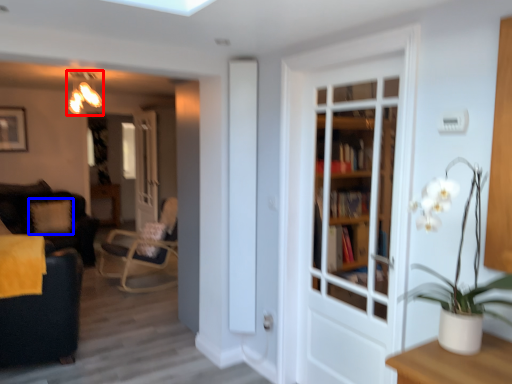
Question: Which object is further to the camera taking this photo, light fixture (highlighted by a red box) or pillow (highlighted by a blue box)?

Choices:
 (A) light fixture
 (B) pillow

Answer: (B)